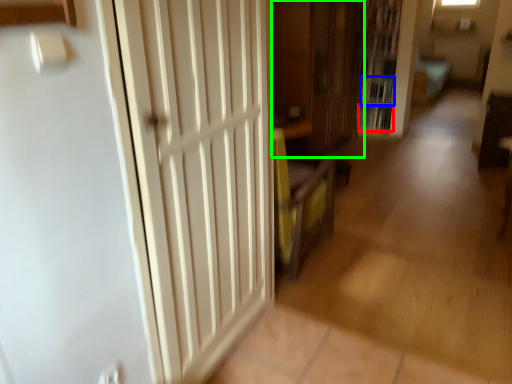
Question: Which is nearer to the book (highlighted by a red box)? book (highlighted by a blue box) or cabinetry (highlighted by a green box).

Choices:
 (A) book
 (B) cabinetry

Answer: (A)